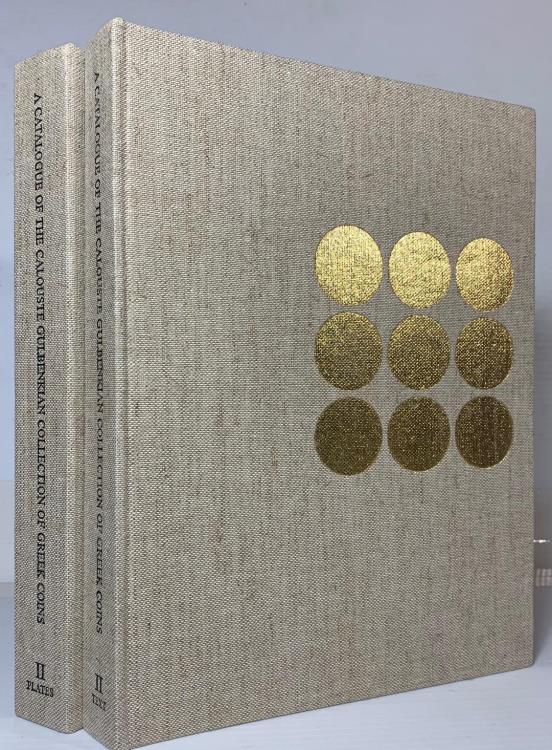
Locate an element on the screen. The height and width of the screenshot is (750, 552). gray book is located at coordinates (213, 580), (67, 555).